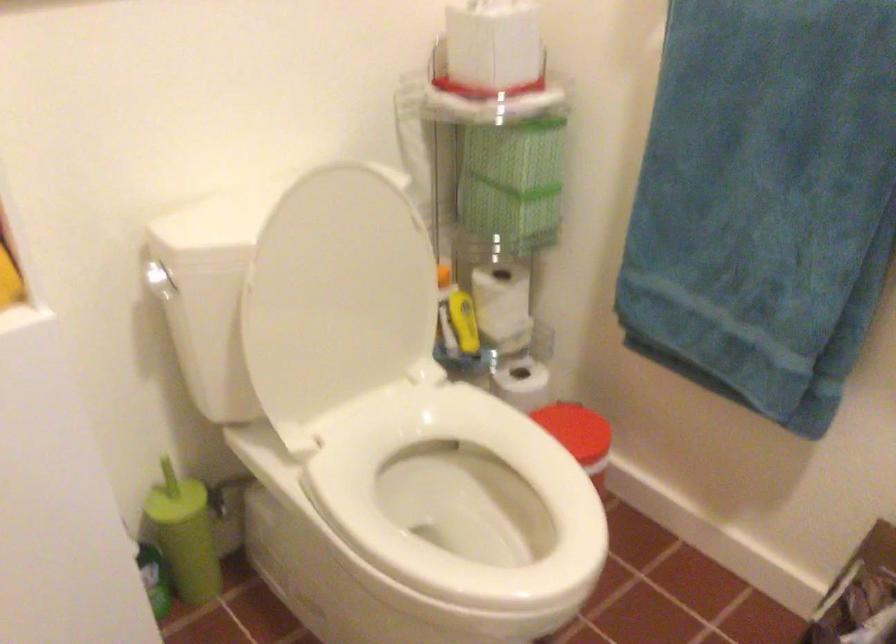
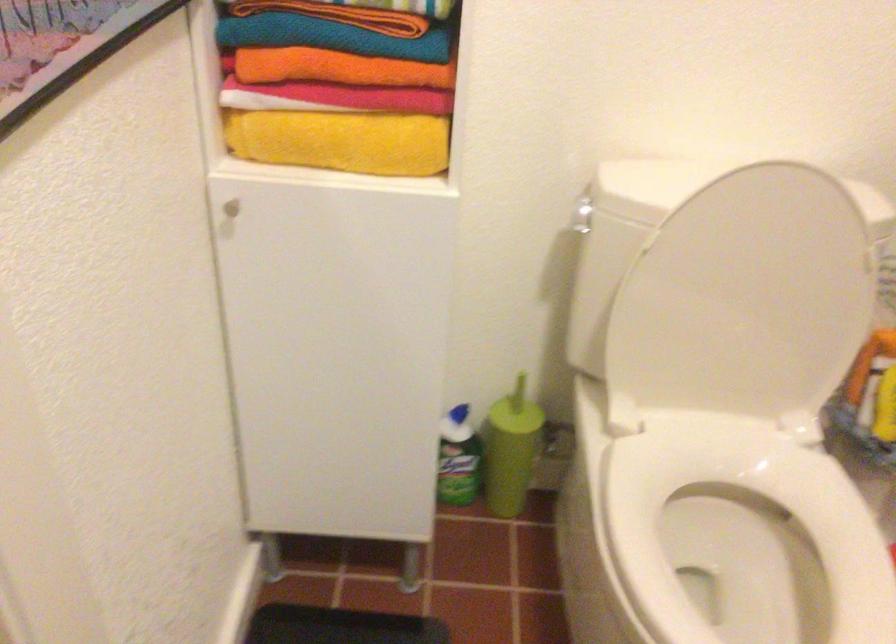
Find the pixel in the second image that matches [428,474] in the first image.

(742, 525)